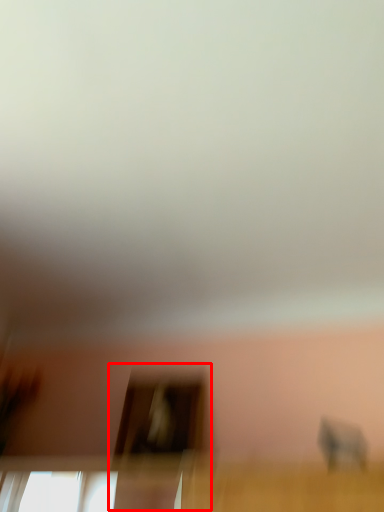
Question: Observing the image, what is the correct spatial positioning of screen door (annotated by the red box) in reference to baby elephant?

Choices:
 (A) left
 (B) right

Answer: (A)